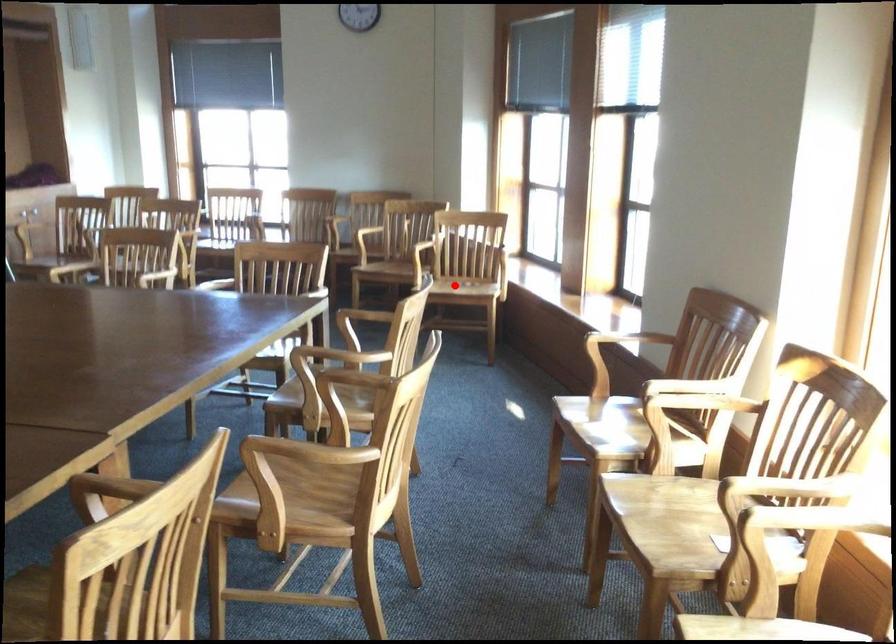
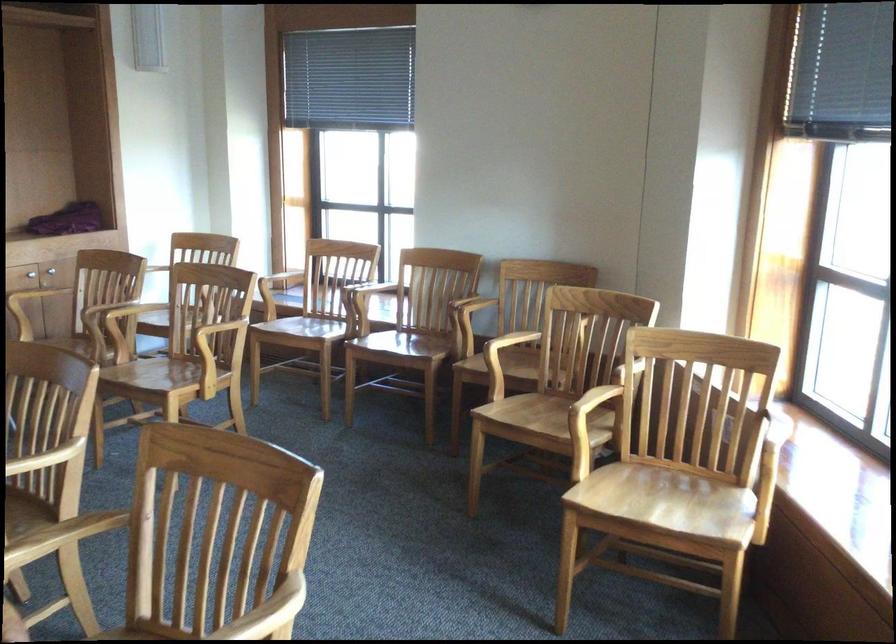
Question: A red point is marked in image1. In image2, is the corresponding 3D point closer to the camera or farther? Reply with the corresponding letter.

Choices:
 (A) The corresponding 3D point is closer.
 (B) The corresponding 3D point is farther.

Answer: (A)